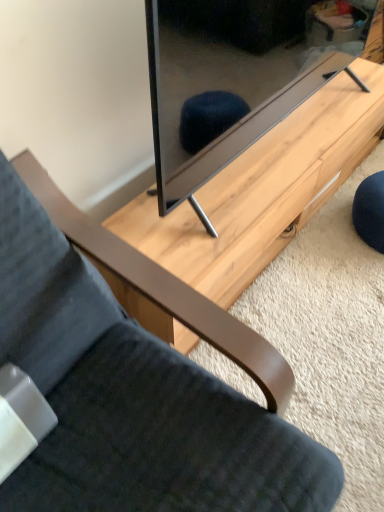
Locate an element on the screen. vacant point above light wood table at center (from a real-world perspective) is located at coordinates (284, 145).